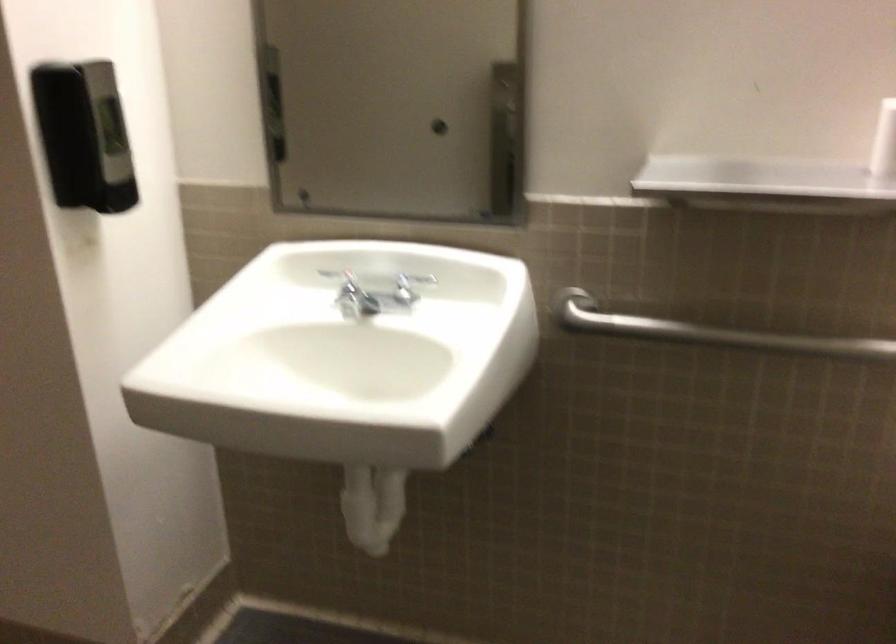
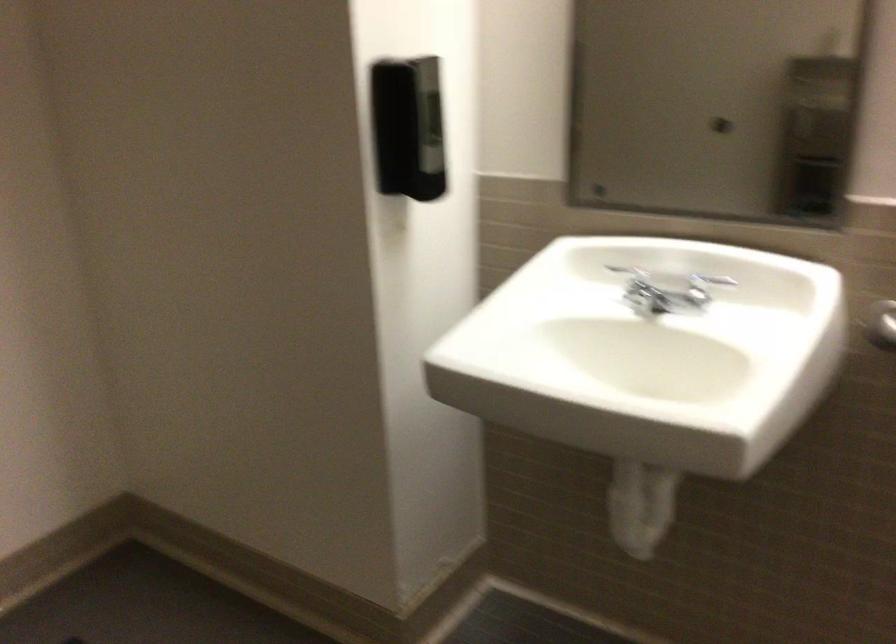
In the second image, find the point that corresponds to pixel 84 138 in the first image.

(408, 128)